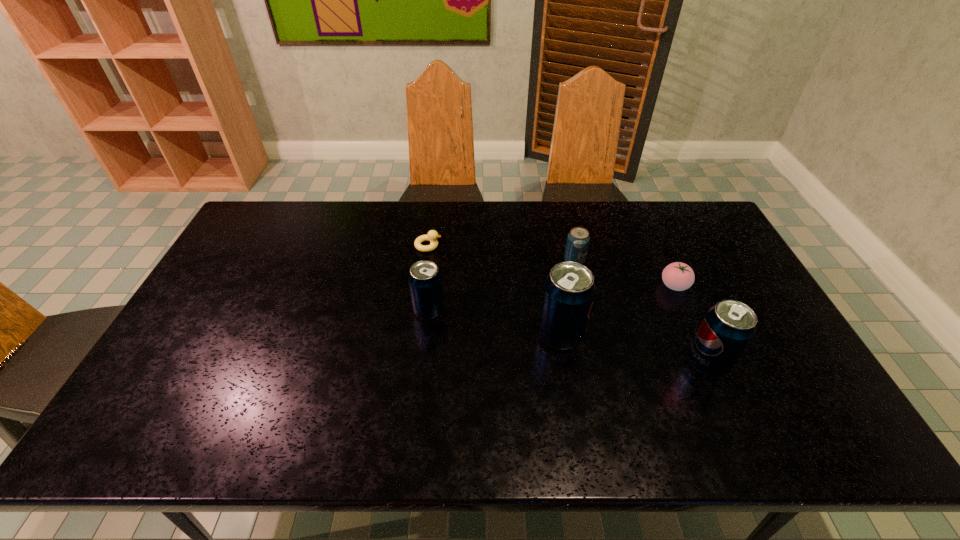
Find the location of `vacant space that satisfies the following two spatial constraints: 1. at the beak of the shortest object; 2. on the back side of the third tallest pop soda`. vacant space that satisfies the following two spatial constraints: 1. at the beak of the shortest object; 2. on the back side of the third tallest pop soda is located at coordinates (420, 310).

At what (x,y) coordinates should I click in order to perform the action: click on vacant area that satisfies the following two spatial constraints: 1. on the front side of the fourth shortest object; 2. on the left side of the third shortest pop soda. Please return your answer as a coordinate pair (x, y). Image resolution: width=960 pixels, height=540 pixels. Looking at the image, I should click on (423, 363).

What are the coordinates of `free space that satisfies the following two spatial constraints: 1. at the beak of the duckling; 2. on the left side of the fifth tallest object` in the screenshot? It's located at (423, 286).

This screenshot has width=960, height=540. Find the location of `blank space that satisfies the following two spatial constraints: 1. at the beak of the shortest object; 2. on the left side of the third shortest pop soda`. blank space that satisfies the following two spatial constraints: 1. at the beak of the shortest object; 2. on the left side of the third shortest pop soda is located at coordinates (413, 363).

Locate an element on the screen. This screenshot has width=960, height=540. free region that satisfies the following two spatial constraints: 1. at the beak of the fifth nearest object; 2. on the left side of the farthest object is located at coordinates (426, 261).